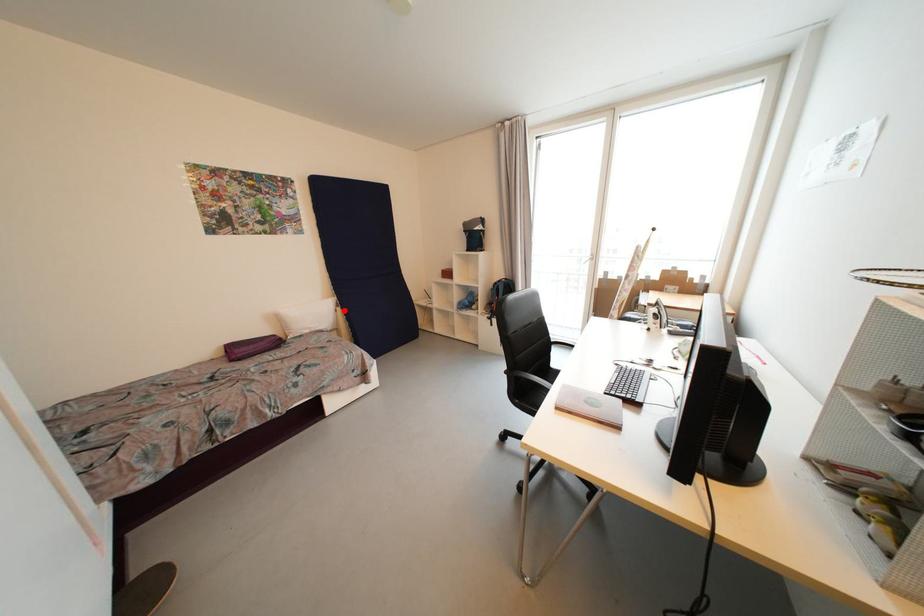
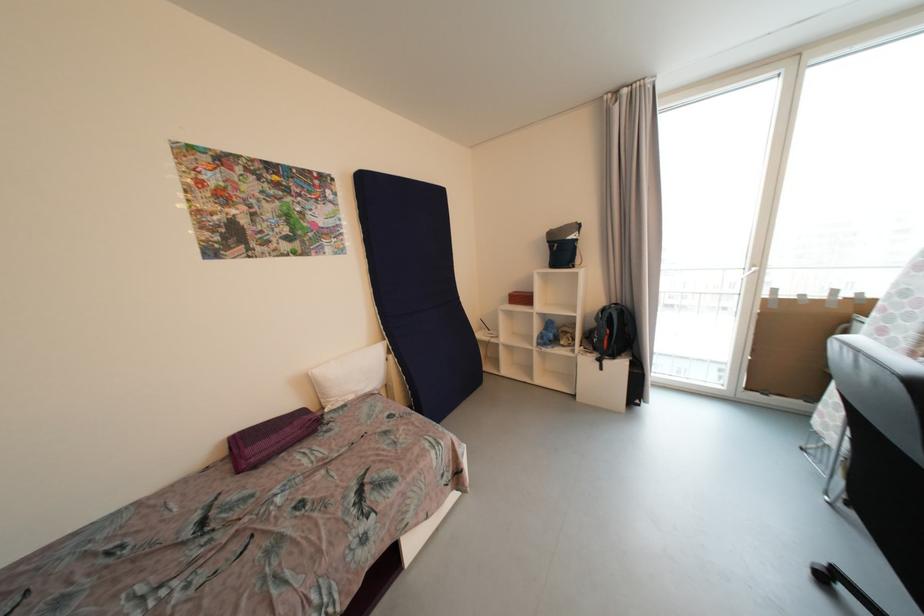
Where in the second image is the point corresponding to the highlighted location from the first image?

(396, 359)